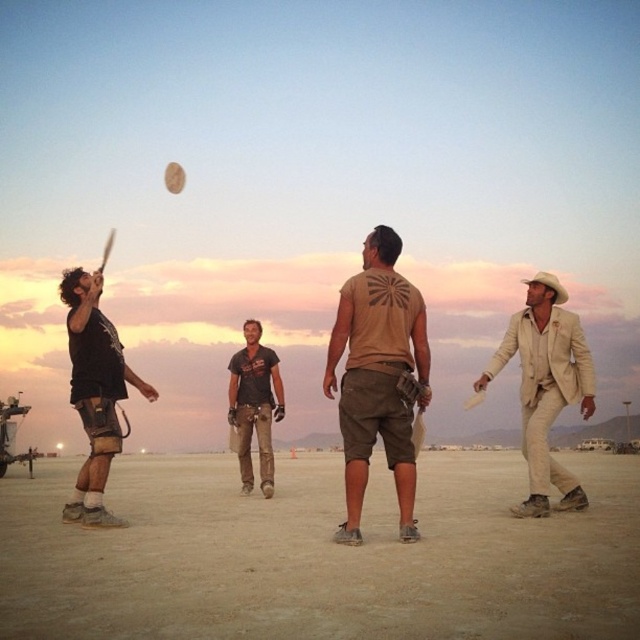
Based on the coordinates provided, which object is located at point (93, 392)?

The point (93, 392) indicates the black matte t shirt at left.

A baseball player is standing at the point marked as point (109,388). If they want to throw a ball to their teammate who is 20.92 meters away, what is the minimum distance they need to cover to reach their teammate?

The minimum distance the baseball player needs to cover to reach their teammate is 20.92 meters, as they are 20.92 meters apart.